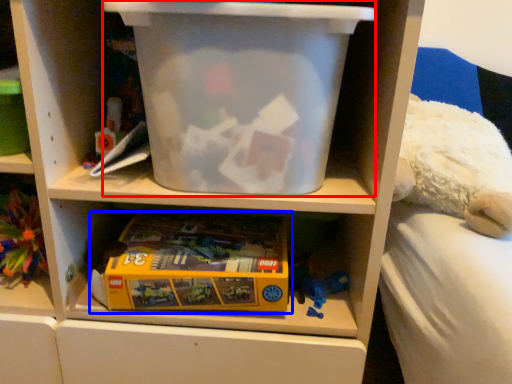
Question: Which of the following is the farthest to the observer, storage box (highlighted by a red box) or toy (highlighted by a blue box)?

Choices:
 (A) storage box
 (B) toy

Answer: (B)